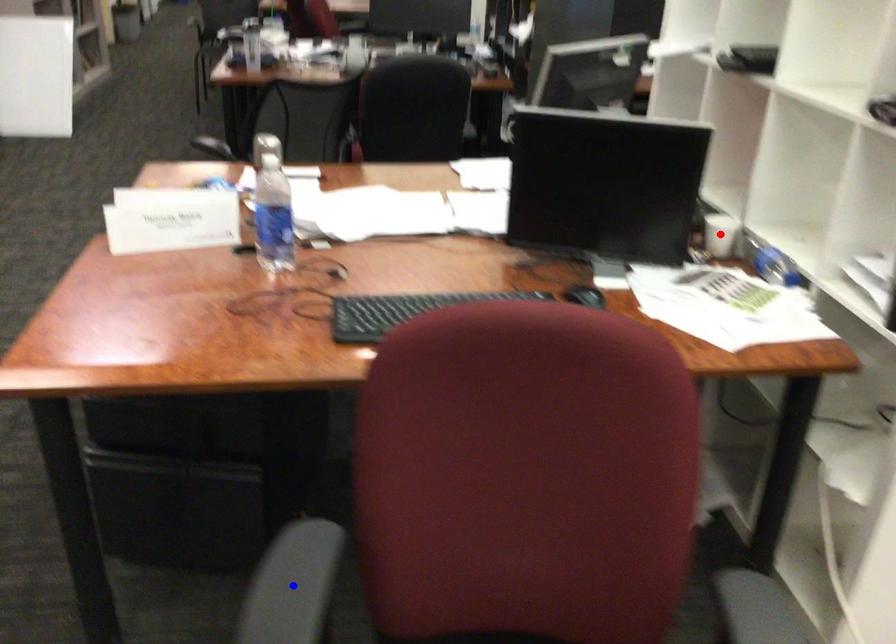
Question: Which of the two points in the image is closer to the camera?

Choices:
 (A) Blue point is closer.
 (B) Red point is closer.

Answer: (A)